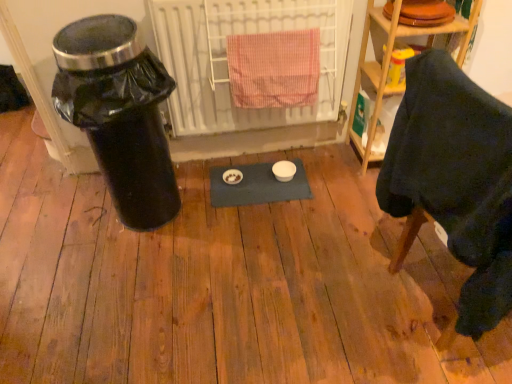
Question: Could you tell me if pink checkered towel at center is facing black plastic trash can at left?

Choices:
 (A) yes
 (B) no

Answer: (B)

Question: Considering the relative sizes of pink checkered towel at center and black plastic trash can at left in the image provided, is pink checkered towel at center thinner than black plastic trash can at left?

Choices:
 (A) yes
 (B) no

Answer: (A)

Question: From a real-world perspective, is pink checkered towel at center located beneath black plastic trash can at left?

Choices:
 (A) yes
 (B) no

Answer: (B)

Question: Is pink checkered towel at center facing away from black plastic trash can at left?

Choices:
 (A) yes
 (B) no

Answer: (B)

Question: Is pink checkered towel at center not near black plastic trash can at left?

Choices:
 (A) yes
 (B) no

Answer: (B)

Question: From the image's perspective, is pink checkered towel at center beneath black plastic trash can at left?

Choices:
 (A) yes
 (B) no

Answer: (B)

Question: Can you confirm if pink checkered towel at center is smaller than wooden shelf at upper right?

Choices:
 (A) yes
 (B) no

Answer: (A)

Question: Considering the relative sizes of pink checkered towel at center and wooden shelf at upper right in the image provided, is pink checkered towel at center shorter than wooden shelf at upper right?

Choices:
 (A) yes
 (B) no

Answer: (A)

Question: Considering the relative sizes of pink checkered towel at center and wooden shelf at upper right in the image provided, is pink checkered towel at center taller than wooden shelf at upper right?

Choices:
 (A) yes
 (B) no

Answer: (B)

Question: Could you tell me if pink checkered towel at center is turned towards wooden shelf at upper right?

Choices:
 (A) yes
 (B) no

Answer: (B)

Question: Considering the relative positions of pink checkered towel at center and wooden shelf at upper right in the image provided, is pink checkered towel at center to the left of wooden shelf at upper right from the viewer's perspective?

Choices:
 (A) no
 (B) yes

Answer: (B)

Question: Is there a large distance between pink checkered towel at center and wooden shelf at upper right?

Choices:
 (A) no
 (B) yes

Answer: (A)

Question: Is dark fabric chair at lower right further to camera compared to white metal radiator at center?

Choices:
 (A) no
 (B) yes

Answer: (A)